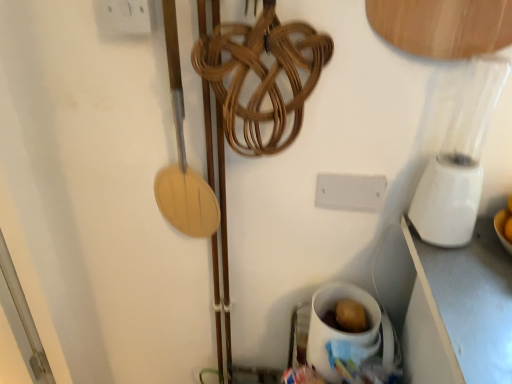
Question: Is white plastic electric outlet at upper left far from white plastic blender at right?

Choices:
 (A) yes
 (B) no

Answer: (B)

Question: From a real-world perspective, is white plastic electric outlet at upper left positioned under white plastic blender at right based on gravity?

Choices:
 (A) no
 (B) yes

Answer: (A)

Question: Considering the relative sizes of white plastic electric outlet at upper left and white plastic blender at right in the image provided, is white plastic electric outlet at upper left smaller than white plastic blender at right?

Choices:
 (A) no
 (B) yes

Answer: (B)

Question: Could you tell me if white plastic electric outlet at upper left is facing white plastic blender at right?

Choices:
 (A) yes
 (B) no

Answer: (B)

Question: From a real-world perspective, is white plastic electric outlet at upper left over white plastic blender at right?

Choices:
 (A) no
 (B) yes

Answer: (B)

Question: Considering the positions of white plastic electric outlet at upper left and white plastic blender at right in the image, is white plastic electric outlet at upper left taller or shorter than white plastic blender at right?

Choices:
 (A) short
 (B) tall

Answer: (A)

Question: Do you think white plastic electric outlet at upper left is within white plastic blender at right, or outside of it?

Choices:
 (A) inside
 (B) outside

Answer: (B)

Question: Considering the positions of white plastic electric outlet at upper left and white plastic blender at right in the image, is white plastic electric outlet at upper left wider or thinner than white plastic blender at right?

Choices:
 (A) thin
 (B) wide

Answer: (A)

Question: Is white plastic electric outlet at upper left to the left or to the right of white plastic blender at right in the image?

Choices:
 (A) right
 (B) left

Answer: (B)

Question: Would you say white plastic blender at right is inside or outside white ceramic mug at lower right?

Choices:
 (A) inside
 (B) outside

Answer: (B)

Question: From a real-world perspective, is white plastic blender at right physically located above or below white ceramic mug at lower right?

Choices:
 (A) below
 (B) above

Answer: (B)

Question: Considering the positions of white plastic blender at right and white ceramic mug at lower right in the image, is white plastic blender at right taller or shorter than white ceramic mug at lower right?

Choices:
 (A) short
 (B) tall

Answer: (B)

Question: Considering the positions of point (449, 150) and point (365, 297), is point (449, 150) closer or farther from the camera than point (365, 297)?

Choices:
 (A) closer
 (B) farther

Answer: (A)

Question: In terms of height, does white ceramic mug at lower right look taller or shorter compared to white plastic electric outlet at upper left?

Choices:
 (A) short
 (B) tall

Answer: (B)

Question: Visually, is white ceramic mug at lower right positioned to the left or to the right of white plastic electric outlet at upper left?

Choices:
 (A) left
 (B) right

Answer: (B)